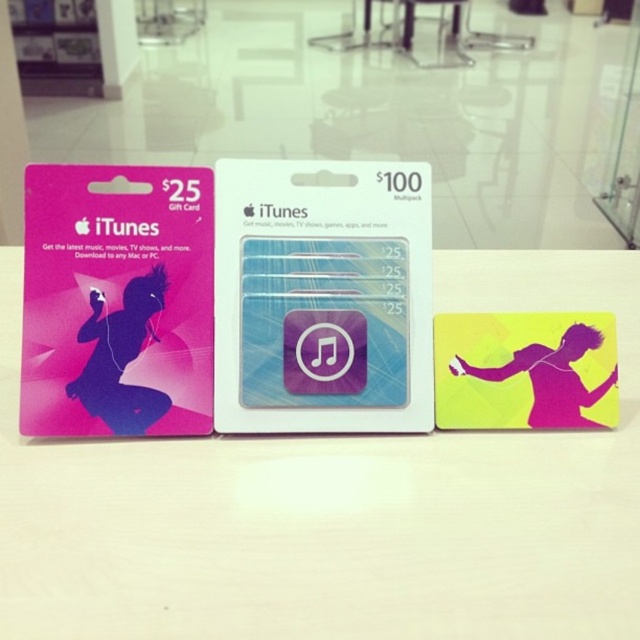
Who is positioned more to the right, white matte table at center or silhouette glossy card at left?

white matte table at center

Locate an element on the screen. The height and width of the screenshot is (640, 640). white matte table at center is located at coordinates (337, 506).

Find the location of a particular element. Image resolution: width=640 pixels, height=640 pixels. white matte table at center is located at coordinates (337, 506).

Between silhouette glossy card at left and silhouette paper at center, which one has more height?

silhouette glossy card at left

Is point (93, 410) behind point (570, 353)?

That is False.

Find the location of a particular element. This screenshot has width=640, height=640. silhouette glossy card at left is located at coordinates (122, 356).

Is point (534, 460) closer to camera compared to point (540, 419)?

That is True.

Which is in front, point (513, 291) or point (560, 428)?

Positioned in front is point (560, 428).

In order to click on white matte table at center in this screenshot , I will do `click(337, 506)`.

You are a GUI agent. You are given a task and a screenshot of the screen. Output one action in this format:
    pyautogui.click(x=<x>, y=<y>)
    Task: Click on the white matte table at center
    
    Given the screenshot: What is the action you would take?
    pyautogui.click(x=337, y=506)